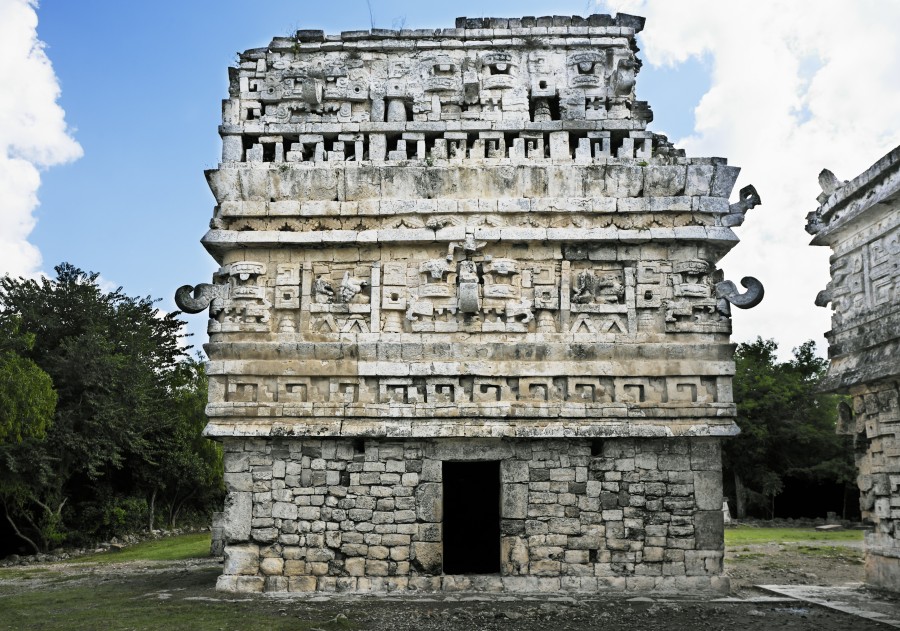
Identify the location of door. The height and width of the screenshot is (631, 900). (481, 508).